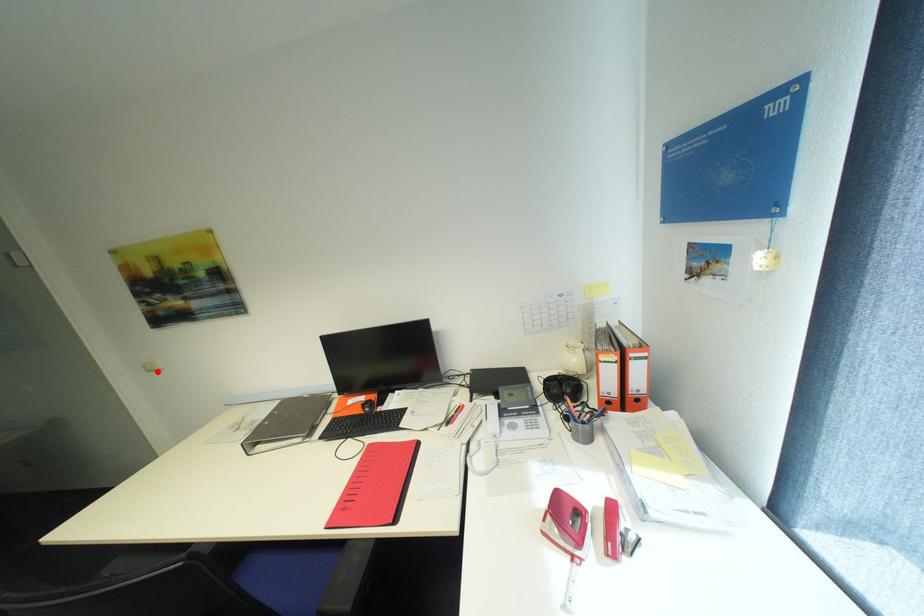
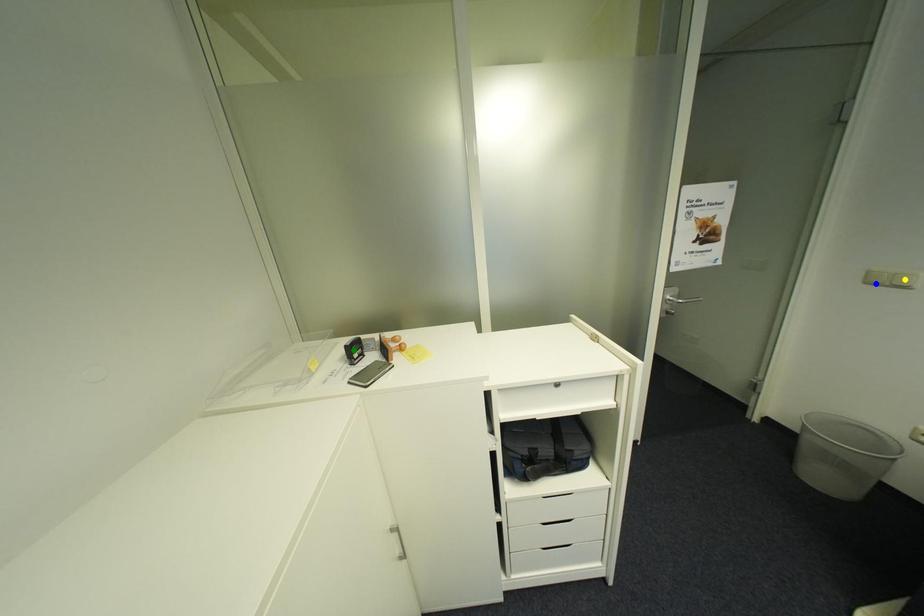
Question: I am providing you with two images of the same scene from different viewpoints. A red point is marked on the first image. You are given multiple points on the second image. Which point in image 2 represents the same 3d spot as the red point in image 1?

Choices:
 (A) yellow point
 (B) blue point
 (C) green point

Answer: (B)